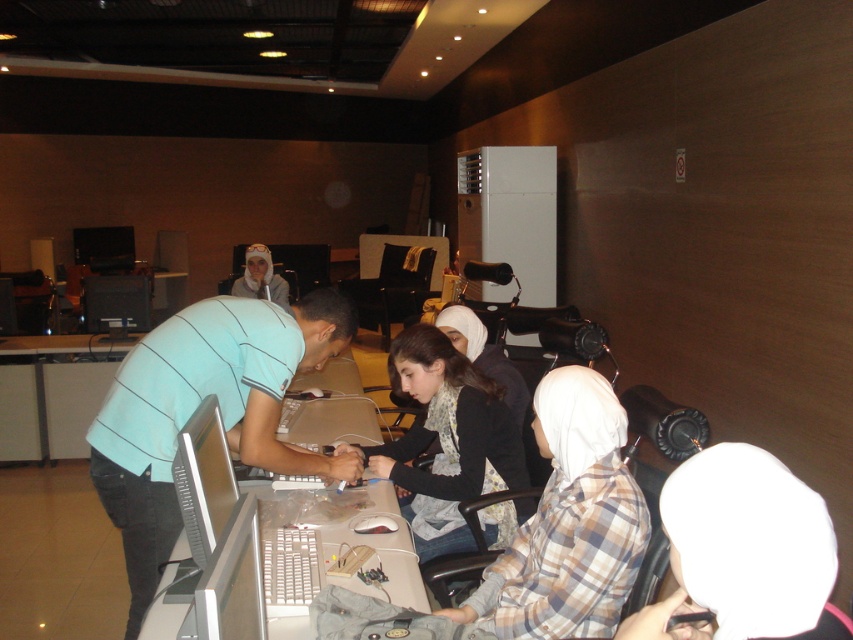
You are setting up a computer station and need to place the matte silver monitor at center and the white plastic computer at center side by side on a desk. Which object should be placed first to ensure they fit properly?

The matte silver monitor at center has a smaller width than the white plastic computer at center, so you should place the white plastic computer at center first to accommodate its larger size before positioning the smaller monitor.

You are a visitor in the room and want to take a photo of the matte silver monitor at center and the white plastic computer at center. Which one will appear larger in your photo?

The matte silver monitor at center will appear larger in the photo because it is closer to the viewer than the white plastic computer at center.

You are standing in the room and want to reach the point marked at coordinates [740,592]. If your arm can extend 35 inches, can you comfortably reach that point without moving your feet?

The distance of point [740,592] from viewer is 37.77 inches, which is slightly beyond your arm reach of 35 inches. You might need to take a small step forward to comfortably reach it.